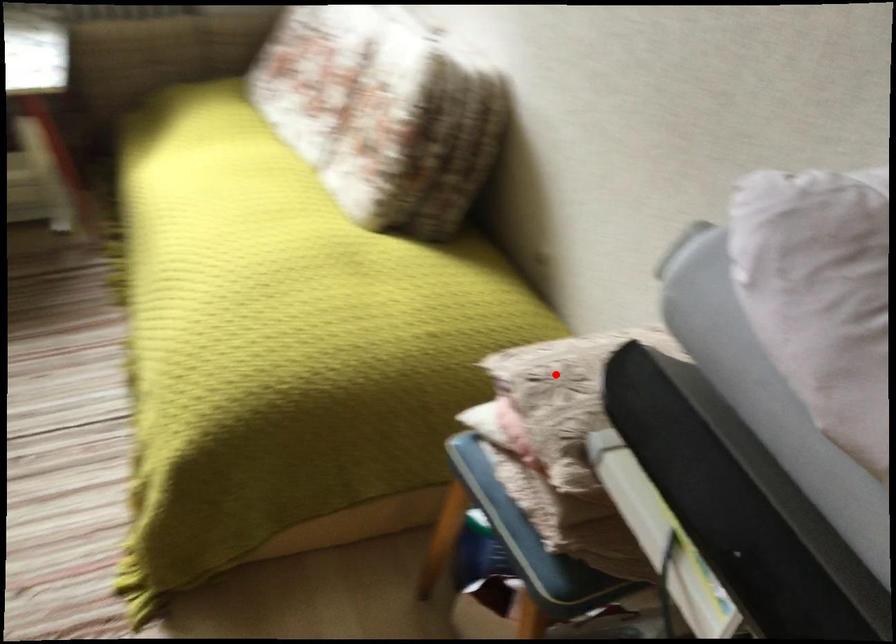
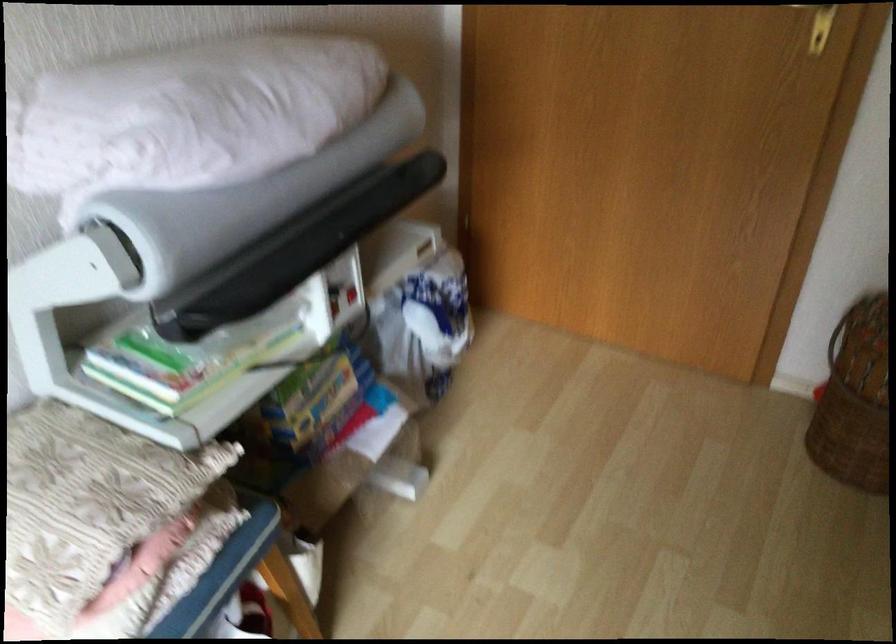
Locate, in the second image, the point that corresponds to the highlighted location in the first image.

(102, 516)